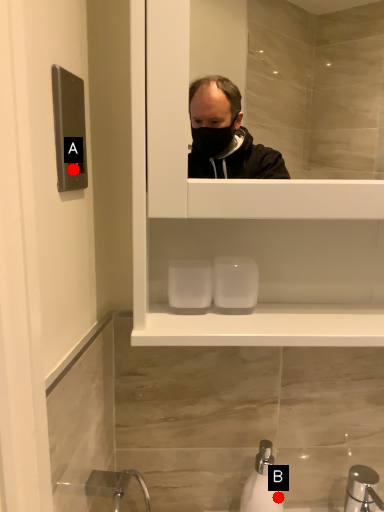
Question: Two points are circled on the image, labeled by A and B beside each circle. Which point is closer to the camera?

Choices:
 (A) A is closer
 (B) B is closer

Answer: (A)